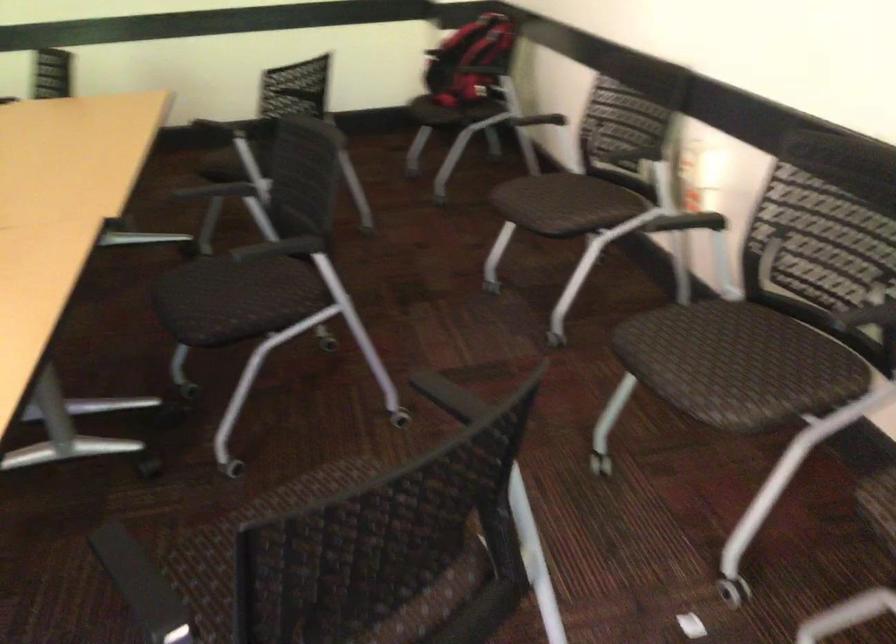
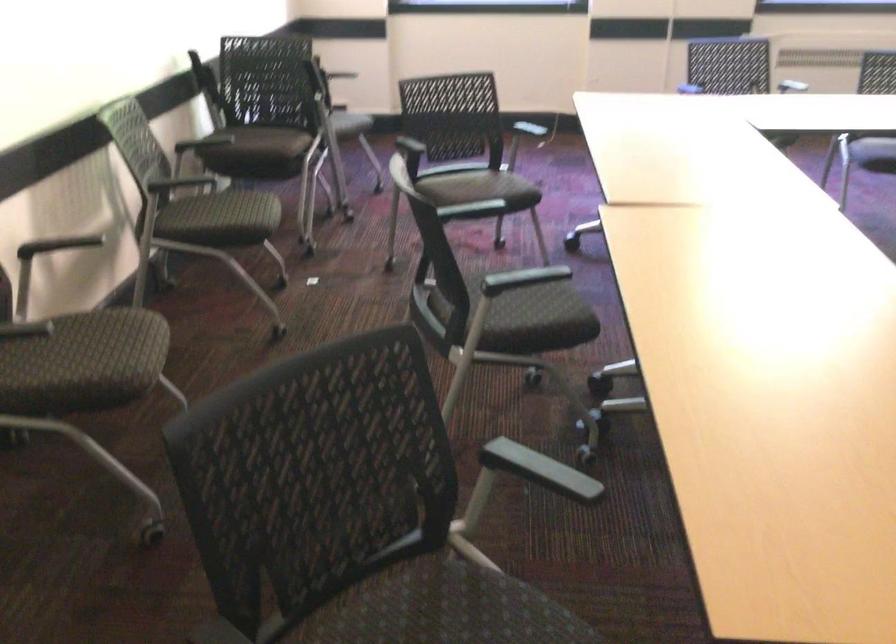
Where in the second image is the point corresponding to the point at 666,333 from the first image?

(250, 216)